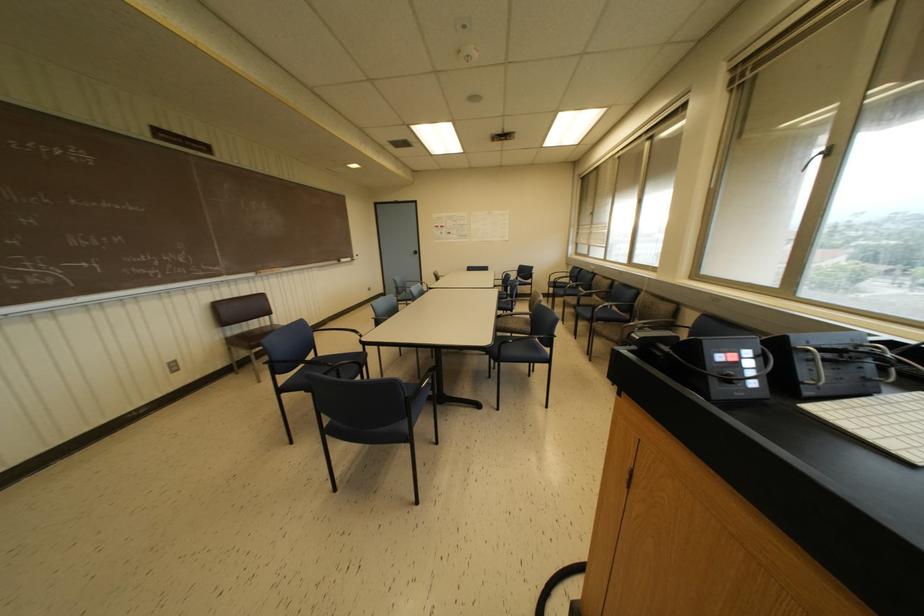
I want to click on metal window handle, so click(819, 156).